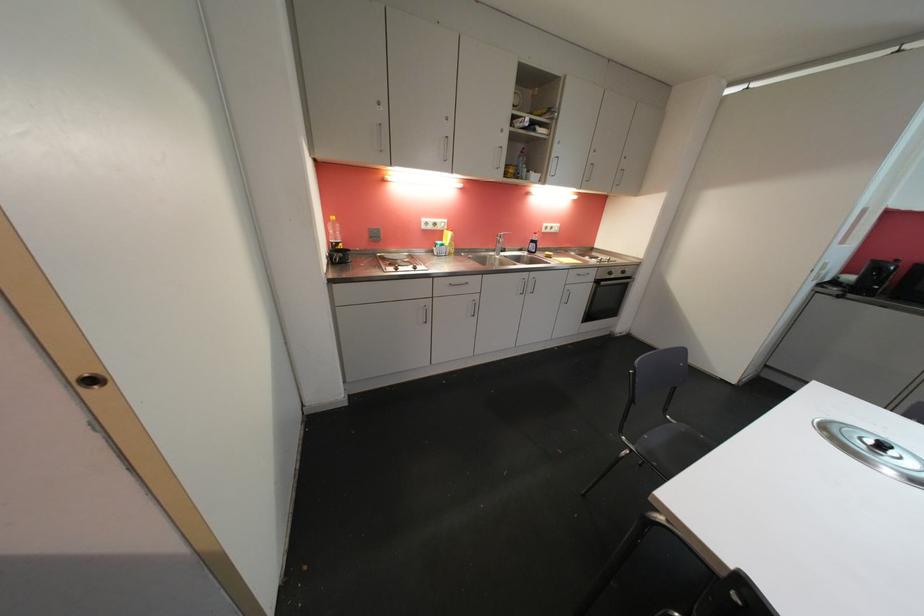
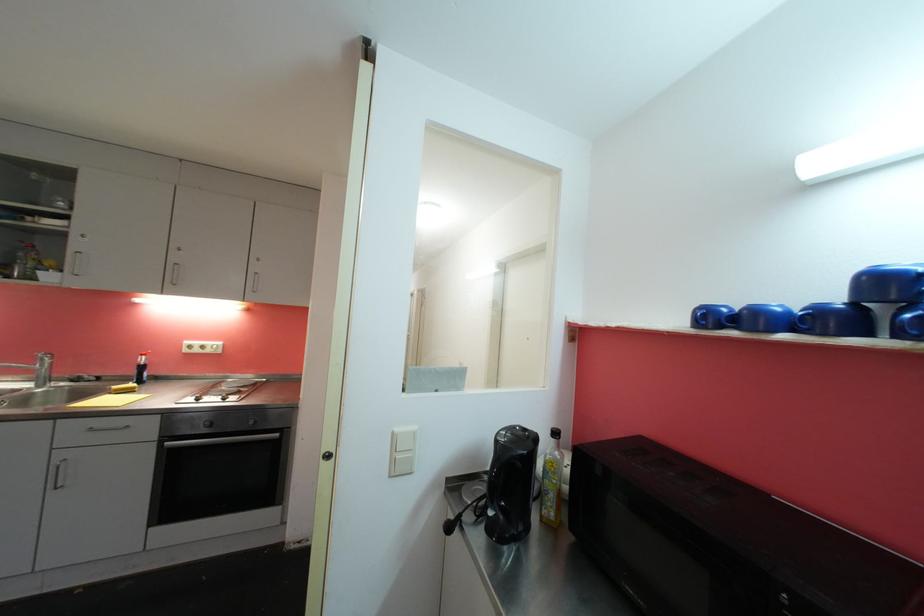
Question: What movement of the cameraman would produce the second image?

Choices:
 (A) Left
 (B) Right
 (C) Forward
 (D) Backward

Answer: (B)